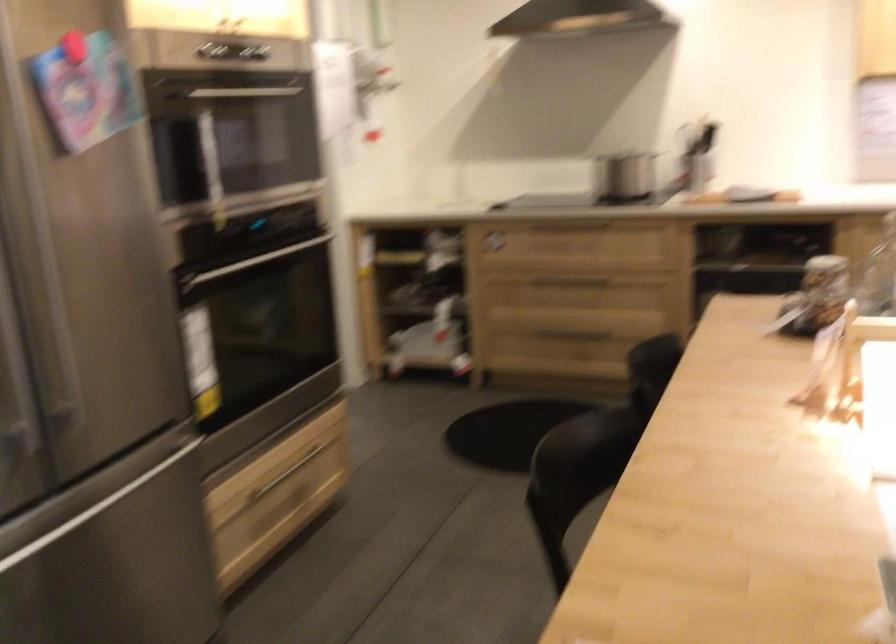
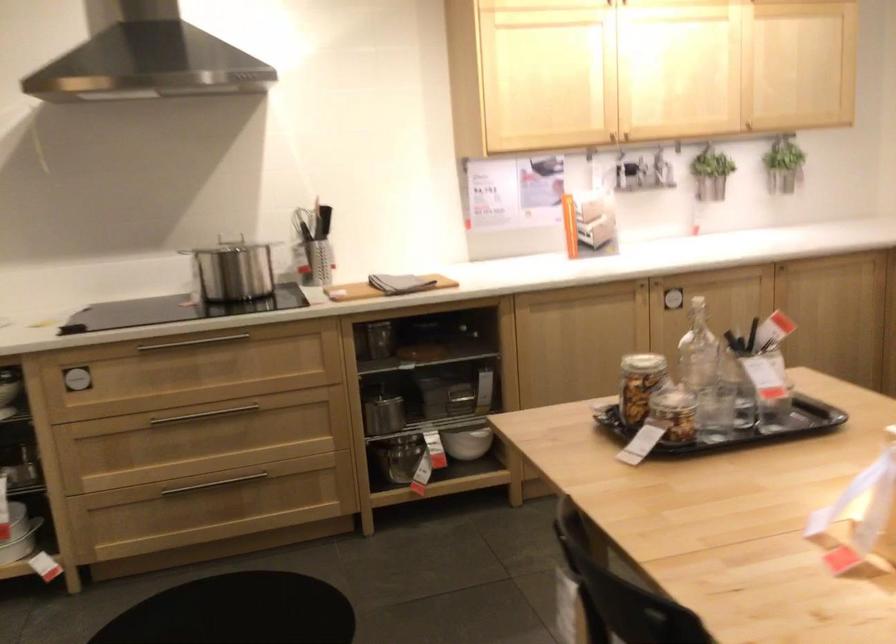
The point at (570, 270) is marked in the first image. Where is the corresponding point in the second image?

(200, 415)